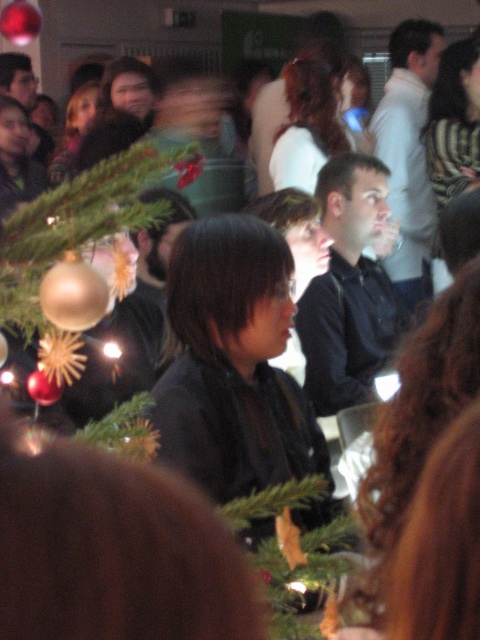
Question: Is gold metallic ornament at center smaller than green matte christmas tree at center?

Choices:
 (A) no
 (B) yes

Answer: (A)

Question: From the image, what is the correct spatial relationship of gold metallic ornament at center in relation to green matte christmas tree at center?

Choices:
 (A) left
 (B) right

Answer: (A)

Question: Considering the relative positions of gold metallic ornament at center and green matte christmas tree at center in the image provided, where is gold metallic ornament at center located with respect to green matte christmas tree at center?

Choices:
 (A) left
 (B) right

Answer: (A)